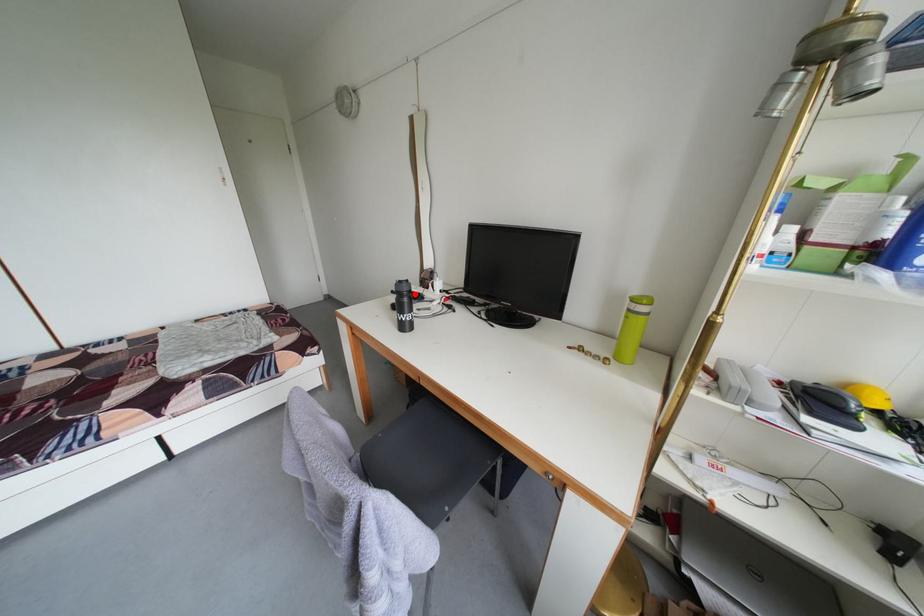
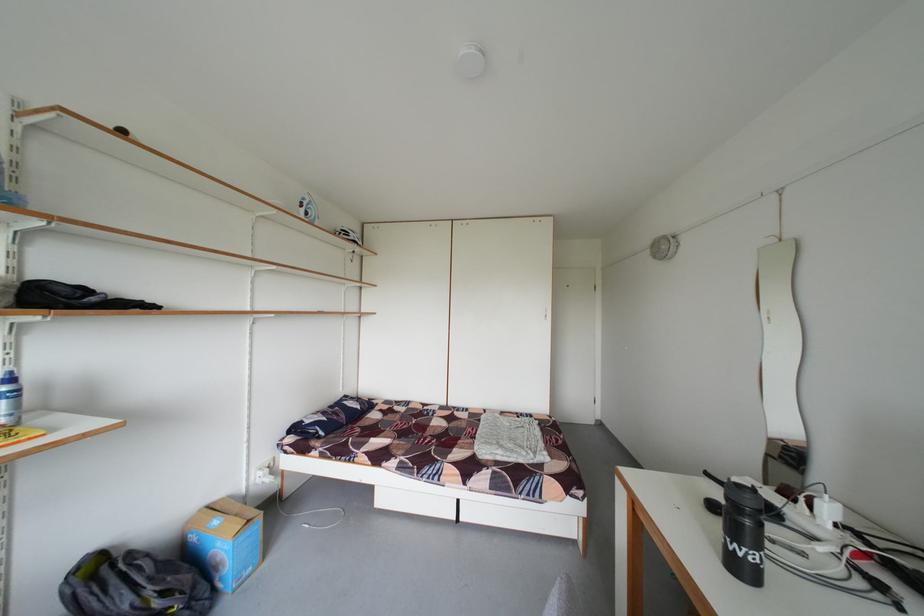
Find the pixel in the second image that matches the highlighted location in the first image.

(759, 507)